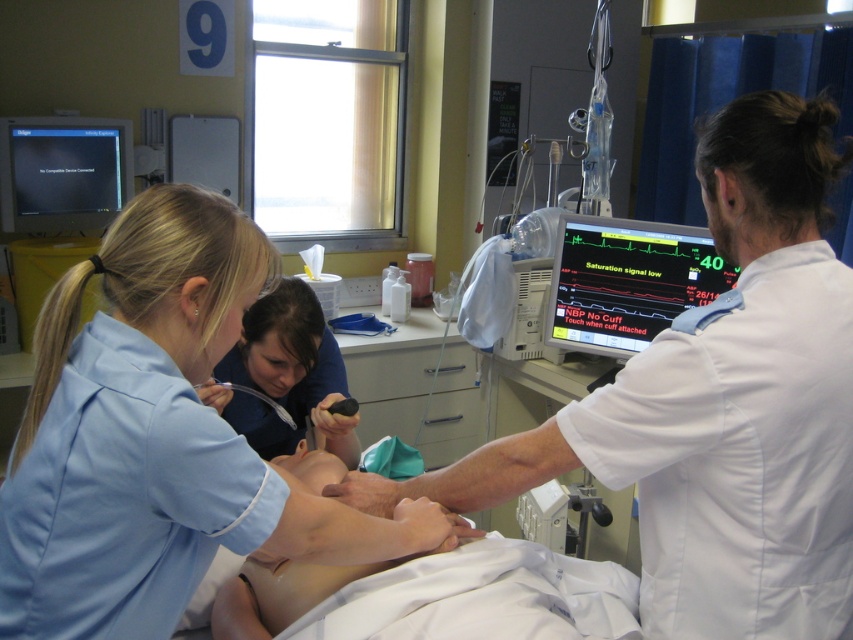
Image resolution: width=853 pixels, height=640 pixels. Find the location of `blue uniform at center`. blue uniform at center is located at coordinates (158, 440).

Who is lower down, blue uniform at center or matte black monitor at center right?

blue uniform at center

Measure the distance between blue uniform at center and camera.

The distance of blue uniform at center from camera is 36.90 inches.

The width and height of the screenshot is (853, 640). Identify the location of blue uniform at center. (158, 440).

Measure the distance between smooth skin child at center and camera.

smooth skin child at center and camera are 1.82 meters apart from each other.

Who is higher up, smooth skin child at center or matte black monitor at upper left?

matte black monitor at upper left is higher up.

Is point (283, 387) less distant than point (108, 141)?

Yes.

Identify the location of smooth skin child at center. (285, 376).

Can you confirm if blue uniform at center is positioned above smooth skin child at center?

No, blue uniform at center is not above smooth skin child at center.

Who is more distant from viewer, (x=149, y=304) or (x=300, y=353)?

Positioned behind is point (x=300, y=353).

The height and width of the screenshot is (640, 853). I want to click on blue uniform at center, so click(x=158, y=440).